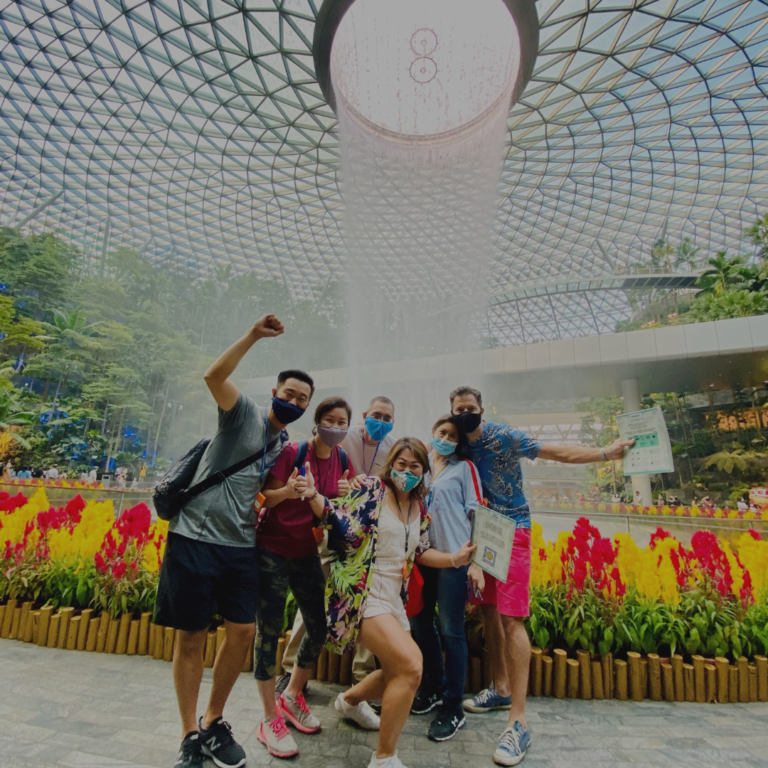
At what (x,y) coordinates should I click in order to perform the action: click on geometric domed ceiling. Please return your answer as a coordinate pair (x, y). The image size is (768, 768). Looking at the image, I should click on (151, 108), (280, 179), (548, 189), (697, 71).